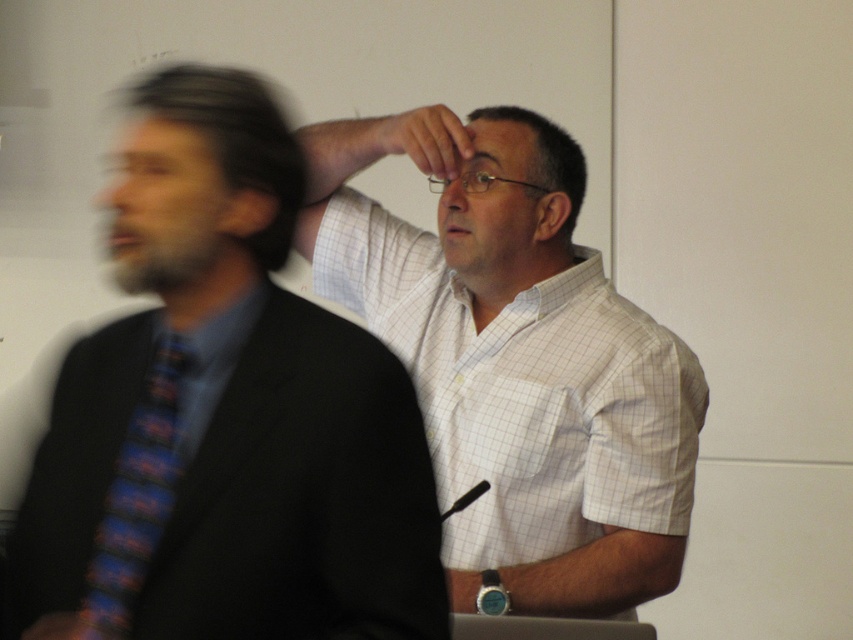
You are taking a photo of two points in a professional setting. The first point is labeled as point (138, 502) and the second is labeled as point (462, 134). Based on their positions, which point is more likely to be in focus in the photo?

Point (138, 502) is closer to the camera than point (462, 134), so it is more likely to be in focus in the photo.

You are a photographer standing in the conference room. You need to position a microphone between the blue striped tie at left and the white checkered shirt at center. The microphone requires a minimum of 1 meter of space to function properly. Can you place it there?

The blue striped tie at left is 80.72 centimeters from the white checkered shirt at center, which is less than 1 meter. Therefore, the microphone cannot be placed between them as there isn